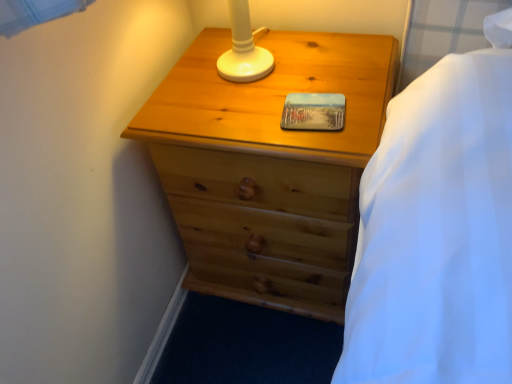
Where is `natural wood chest of drawers at center`? This screenshot has width=512, height=384. natural wood chest of drawers at center is located at coordinates (269, 166).

Describe the element at coordinates (269, 166) in the screenshot. This screenshot has width=512, height=384. I see `natural wood chest of drawers at center` at that location.

The height and width of the screenshot is (384, 512). What do you see at coordinates (313, 112) in the screenshot?
I see `metallic photo frame at center` at bounding box center [313, 112].

Where is `metallic photo frame at center`? The height and width of the screenshot is (384, 512). metallic photo frame at center is located at coordinates (313, 112).

Find the location of a particular element. The image size is (512, 384). natural wood chest of drawers at center is located at coordinates (269, 166).

Which is more to the left, metallic photo frame at center or natural wood chest of drawers at center?

natural wood chest of drawers at center is more to the left.

Is the depth of metallic photo frame at center greater than that of natural wood chest of drawers at center?

Yes.

Is point (328, 95) closer or farther from the camera than point (334, 301)?

Point (328, 95).

From the image's perspective, does metallic photo frame at center appear higher than natural wood chest of drawers at center?

Yes, from the image's perspective, metallic photo frame at center is above natural wood chest of drawers at center.

From a real-world perspective, who is located higher, metallic photo frame at center or natural wood chest of drawers at center?

In real-world perspective, metallic photo frame at center is above.

Looking at this image, can you confirm if metallic photo frame at center is wider than natural wood chest of drawers at center?

Incorrect, the width of metallic photo frame at center does not surpass that of natural wood chest of drawers at center.

Between metallic photo frame at center and natural wood chest of drawers at center, which one has more height?

With more height is natural wood chest of drawers at center.

Who is smaller, metallic photo frame at center or natural wood chest of drawers at center?

metallic photo frame at center is smaller.

Is metallic photo frame at center spatially inside natural wood chest of drawers at center, or outside of it?

metallic photo frame at center is enclosed within natural wood chest of drawers at center.

Is the surface of metallic photo frame at center in direct contact with natural wood chest of drawers at center?

metallic photo frame at center and natural wood chest of drawers at center are clearly separated.

Is metallic photo frame at center turned away from natural wood chest of drawers at center?

Yes, metallic photo frame at center is facing away from natural wood chest of drawers at center.

What's the angular difference between metallic photo frame at center and natural wood chest of drawers at center's facing directions?

The angular difference between metallic photo frame at center and natural wood chest of drawers at center is 0.000594 degrees.

Where is `pad above the natural wood chest of drawers at center (from the image's perspective)`? pad above the natural wood chest of drawers at center (from the image's perspective) is located at coordinates (313, 112).

Which object is positioned more to the right, natural wood chest of drawers at center or metallic photo frame at center?

metallic photo frame at center is more to the right.

Looking at this image, who is more distant, natural wood chest of drawers at center or metallic photo frame at center?

metallic photo frame at center is further from the camera.

Is point (349, 139) closer to camera compared to point (339, 103)?

Yes, it is in front of point (339, 103).

From the image's perspective, which one is positioned higher, natural wood chest of drawers at center or metallic photo frame at center?

metallic photo frame at center.

From a real-world perspective, is natural wood chest of drawers at center physically below metallic photo frame at center?

Correct, in the physical world, natural wood chest of drawers at center is lower than metallic photo frame at center.

In terms of width, does natural wood chest of drawers at center look wider or thinner when compared to metallic photo frame at center?

Clearly, natural wood chest of drawers at center has more width compared to metallic photo frame at center.

Considering the sizes of objects natural wood chest of drawers at center and metallic photo frame at center in the image provided, who is shorter, natural wood chest of drawers at center or metallic photo frame at center?

metallic photo frame at center.

Can you confirm if natural wood chest of drawers at center is smaller than metallic photo frame at center?

Actually, natural wood chest of drawers at center might be larger than metallic photo frame at center.

Is natural wood chest of drawers at center situated inside metallic photo frame at center or outside?

natural wood chest of drawers at center is not inside metallic photo frame at center, it's outside.

Is natural wood chest of drawers at center touching metallic photo frame at center?

No, natural wood chest of drawers at center is not next to metallic photo frame at center.

Is natural wood chest of drawers at center aimed at metallic photo frame at center?

No, natural wood chest of drawers at center is not oriented towards metallic photo frame at center.

How much distance is there between natural wood chest of drawers at center and metallic photo frame at center?

natural wood chest of drawers at center and metallic photo frame at center are 9.47 inches apart.

The image size is (512, 384). In the image, there is a metallic photo frame at center. Identify the location of the chest of drawers below it (from the image's perspective). (269, 166).

You are a GUI agent. You are given a task and a screenshot of the screen. Output one action in this format:
    pyautogui.click(x=<x>, y=<y>)
    Task: Click on the pad above the natural wood chest of drawers at center (from the image's perspective)
    The width and height of the screenshot is (512, 384).
    Given the screenshot: What is the action you would take?
    pyautogui.click(x=313, y=112)

Locate an element on the screen. Image resolution: width=512 pixels, height=384 pixels. pad behind the natural wood chest of drawers at center is located at coordinates (313, 112).